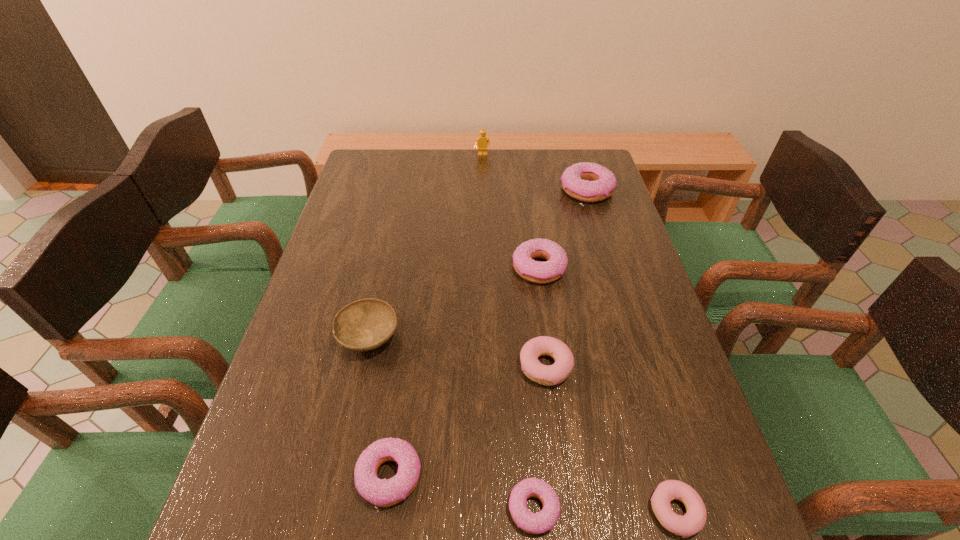
Where is `the farthest object`? The height and width of the screenshot is (540, 960). the farthest object is located at coordinates (482, 141).

Locate an element on the screen. Lego is located at coordinates (482, 141).

Image resolution: width=960 pixels, height=540 pixels. In order to click on the farthest doughnut in this screenshot , I will do `click(588, 182)`.

Find the location of a particular element. The image size is (960, 540). the seventh nearest object is located at coordinates (588, 182).

The image size is (960, 540). I want to click on the second tallest doughnut, so tap(534, 271).

At what (x,y) coordinates should I click in order to perform the action: click on the second farthest doughnut. Please return your answer as a coordinate pair (x, y). Looking at the image, I should click on (534, 271).

Identify the location of bowl. (366, 324).

Identify the location of the farther pink doughnut. (548, 375).

You are a GUI agent. You are given a task and a screenshot of the screen. Output one action in this format:
    pyautogui.click(x=<x>, y=<y>)
    Task: Click on the fourth nearest doughnut
    The image size is (960, 540).
    Given the screenshot: What is the action you would take?
    pyautogui.click(x=548, y=375)

This screenshot has height=540, width=960. I want to click on the second smallest purple doughnut, so click(x=383, y=493).